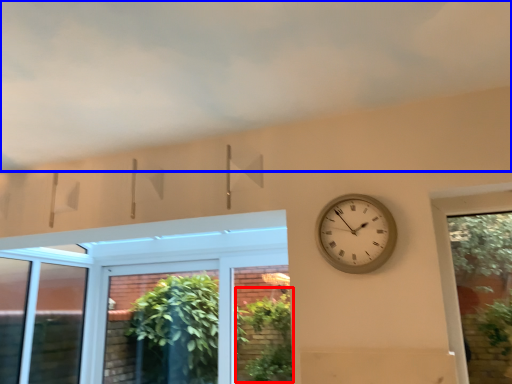
Question: Which object appears farthest to the camera in this image, plant (highlighted by a red box) or cloud (highlighted by a blue box)?

Choices:
 (A) plant
 (B) cloud

Answer: (A)